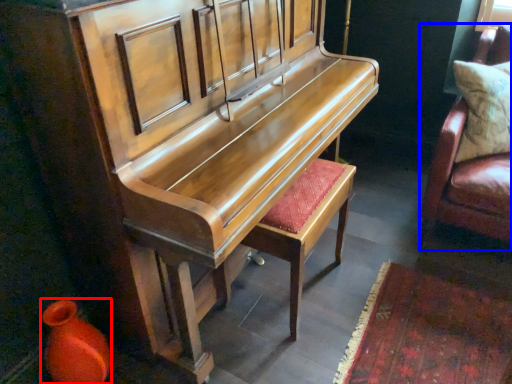
Question: Which of the following is the farthest to the observer, vase (highlighted by a red box) or furniture (highlighted by a blue box)?

Choices:
 (A) vase
 (B) furniture

Answer: (B)